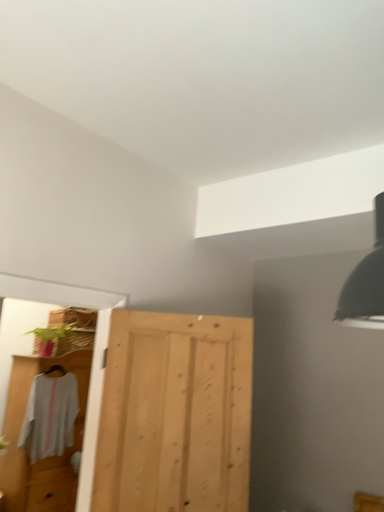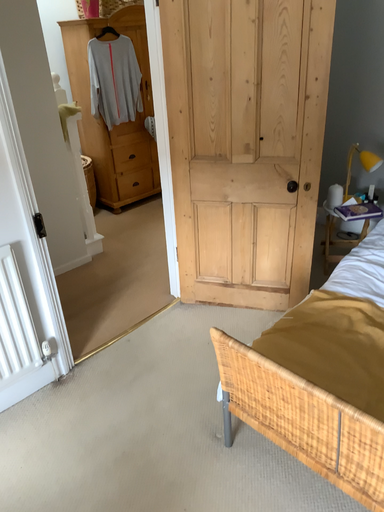
Question: How did the camera likely rotate when shooting the video?

Choices:
 (A) rotated upward
 (B) rotated downward

Answer: (B)